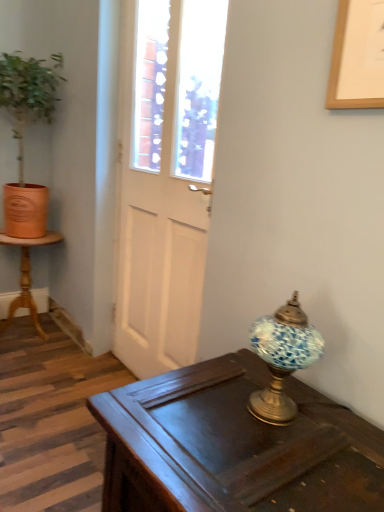
Question: Is dark wood desk at center aimed at blue mosaic glass lamp at right?

Choices:
 (A) yes
 (B) no

Answer: (B)

Question: Is dark wood desk at center next to blue mosaic glass lamp at right?

Choices:
 (A) yes
 (B) no

Answer: (B)

Question: Does dark wood desk at center have a greater height compared to blue mosaic glass lamp at right?

Choices:
 (A) yes
 (B) no

Answer: (A)

Question: Can you confirm if dark wood desk at center is thinner than blue mosaic glass lamp at right?

Choices:
 (A) no
 (B) yes

Answer: (A)

Question: From the image's perspective, is dark wood desk at center above blue mosaic glass lamp at right?

Choices:
 (A) no
 (B) yes

Answer: (A)

Question: Is blue mosaic glass lamp at right surrounded by dark wood desk at center?

Choices:
 (A) no
 (B) yes

Answer: (A)

Question: From a real-world perspective, is wooden pedestal table at left located beneath white glossy door at center?

Choices:
 (A) no
 (B) yes

Answer: (B)

Question: Is white glossy door at center inside wooden pedestal table at left?

Choices:
 (A) yes
 (B) no

Answer: (B)

Question: Considering the relative sizes of wooden pedestal table at left and white glossy door at center in the image provided, is wooden pedestal table at left thinner than white glossy door at center?

Choices:
 (A) no
 (B) yes

Answer: (A)

Question: Can you confirm if wooden pedestal table at left is positioned to the left of white glossy door at center?

Choices:
 (A) yes
 (B) no

Answer: (A)

Question: Is wooden pedestal table at left positioned in front of white glossy door at center?

Choices:
 (A) no
 (B) yes

Answer: (A)

Question: Considering the relative sizes of wooden pedestal table at left and white glossy door at center in the image provided, is wooden pedestal table at left wider than white glossy door at center?

Choices:
 (A) no
 (B) yes

Answer: (B)

Question: Is blue mosaic glass lamp at right looking in the opposite direction of white glossy door at center?

Choices:
 (A) yes
 (B) no

Answer: (B)